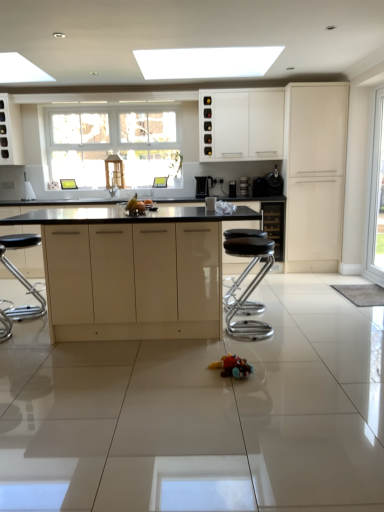
Question: From a real-world perspective, is black glossy coffee machine at center, the 2th appliance when ordered from right to left, located beneath metallic silver coffee machine at center, the 3th appliance in the right-to-left sequence?

Choices:
 (A) yes
 (B) no

Answer: (B)

Question: Is black glossy coffee machine at center, marked as the 3th appliance in a left-to-right arrangement, further to the viewer compared to metallic silver coffee machine at center, positioned as the second appliance in left-to-right order?

Choices:
 (A) yes
 (B) no

Answer: (B)

Question: Does black glossy coffee machine at center, marked as the 3th appliance in a left-to-right arrangement, have a lesser width compared to metallic silver coffee machine at center, the 3th appliance in the right-to-left sequence?

Choices:
 (A) no
 (B) yes

Answer: (A)

Question: Is metallic silver coffee machine at center, the 3th appliance in the right-to-left sequence, completely or partially inside black glossy coffee machine at center, marked as the 3th appliance in a left-to-right arrangement?

Choices:
 (A) yes
 (B) no

Answer: (B)

Question: Is the depth of black glossy coffee machine at center, the 2th appliance when ordered from right to left, less than that of metallic silver coffee machine at center, positioned as the second appliance in left-to-right order?

Choices:
 (A) yes
 (B) no

Answer: (A)

Question: Is metallic silver coffee machine at center, positioned as the second appliance in left-to-right order, inside or outside of transparent glass door at right?

Choices:
 (A) inside
 (B) outside

Answer: (B)

Question: Considering their positions, is metallic silver coffee machine at center, the 3th appliance in the right-to-left sequence, located in front of or behind transparent glass door at right?

Choices:
 (A) front
 (B) behind

Answer: (B)

Question: From a real-world perspective, is metallic silver coffee machine at center, positioned as the second appliance in left-to-right order, above or below transparent glass door at right?

Choices:
 (A) above
 (B) below

Answer: (B)

Question: Considering the positions of point (246, 189) and point (377, 170), is point (246, 189) closer or farther from the camera than point (377, 170)?

Choices:
 (A) closer
 (B) farther

Answer: (B)

Question: Would you say black glossy coffee maker at right, placed as the 1th appliance when sorted from right to left, is to the left or to the right of black plastic coffee maker at center, the first appliance positioned from the left, in the picture?

Choices:
 (A) right
 (B) left

Answer: (A)

Question: Based on their sizes in the image, would you say black glossy coffee maker at right, placed as the 1th appliance when sorted from right to left, is bigger or smaller than black plastic coffee maker at center, which is counted as the 4th appliance, starting from the right?

Choices:
 (A) small
 (B) big

Answer: (B)

Question: Is point (279, 194) positioned closer to the camera than point (231, 181)?

Choices:
 (A) farther
 (B) closer

Answer: (B)

Question: Is black glossy coffee maker at right, placed as the 1th appliance when sorted from right to left, wider or thinner than black plastic coffee maker at center, the first appliance positioned from the left?

Choices:
 (A) wide
 (B) thin

Answer: (A)

Question: Is white glossy cabinet at upper center, acting as the 3th cabinetry starting from the right, to the left or to the right of metallic silver coffee machine at center, the 3th appliance in the right-to-left sequence, in the image?

Choices:
 (A) right
 (B) left

Answer: (B)

Question: From a real-world perspective, is white glossy cabinet at upper center, the third cabinetry positioned from the front, physically located above or below metallic silver coffee machine at center, the 3th appliance in the right-to-left sequence?

Choices:
 (A) above
 (B) below

Answer: (A)